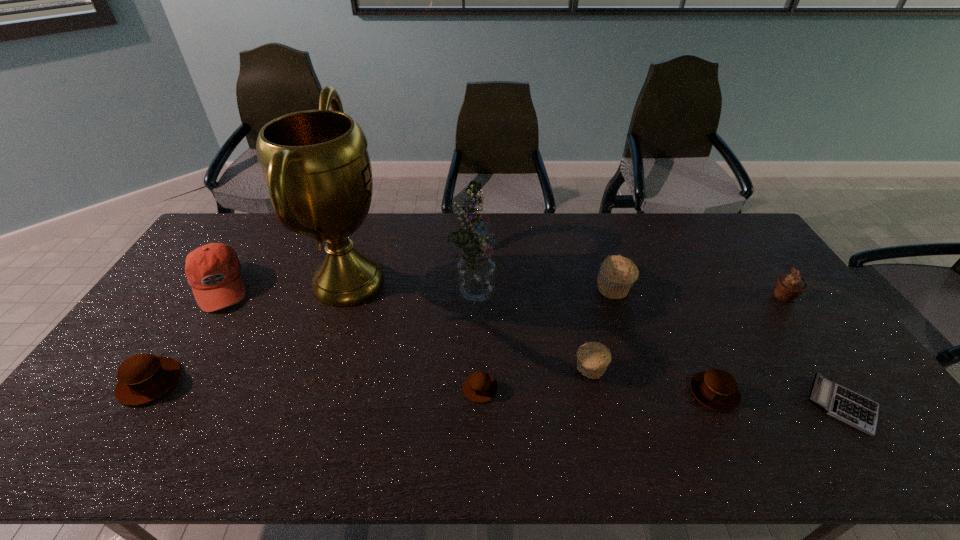
Find the location of a particular element. Image resolution: width=960 pixels, height=540 pixels. muffin that is at the left edge is located at coordinates (143, 378).

Where is `muffin at the right edge`? This screenshot has width=960, height=540. muffin at the right edge is located at coordinates (789, 286).

At what (x,y) coordinates should I click in order to perform the action: click on calculator that is at the right edge. Please return your answer as a coordinate pair (x, y). Image resolution: width=960 pixels, height=540 pixels. Looking at the image, I should click on (850, 407).

The width and height of the screenshot is (960, 540). I want to click on object located in the near right corner section of the desktop, so click(850, 407).

In the image, there is a desktop. Where is `blank space at the far edge`? This screenshot has height=540, width=960. blank space at the far edge is located at coordinates (522, 215).

In the image, there is a desktop. Find the location of `vacant space at the near edge`. vacant space at the near edge is located at coordinates (271, 441).

I want to click on free location at the left edge of the desktop, so click(110, 416).

This screenshot has height=540, width=960. In order to click on free space at the right edge in this screenshot , I will do `click(795, 374)`.

Where is `vacant region between the baseball cap and the eighth object from right to left`? vacant region between the baseball cap and the eighth object from right to left is located at coordinates (284, 284).

I want to click on free space between the sixth object from left to right and the rightmost muffin, so click(686, 333).